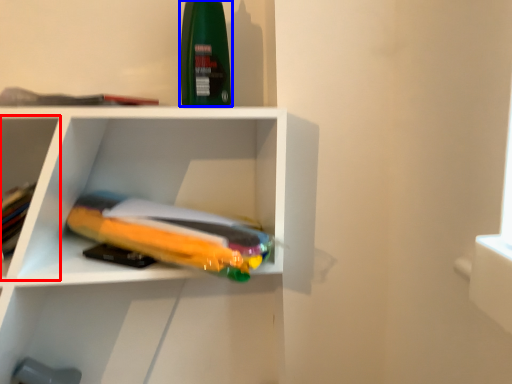
Question: Which object appears closest to the camera in this image, shelf (highlighted by a red box) or cleaning product (highlighted by a blue box)?

Choices:
 (A) shelf
 (B) cleaning product

Answer: (A)